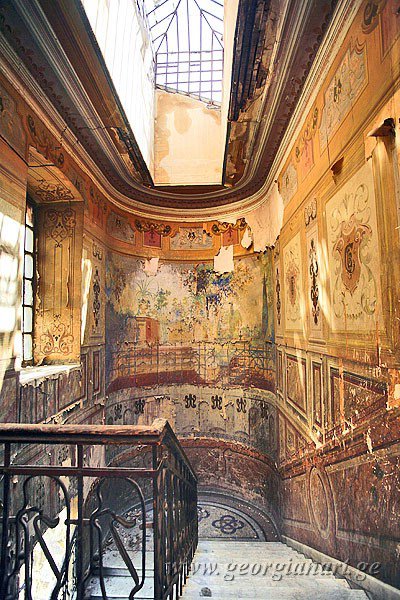
Identify the location of stairs. The width and height of the screenshot is (400, 600). (263, 588), (262, 581), (254, 556), (252, 549), (252, 544), (112, 559), (122, 583).